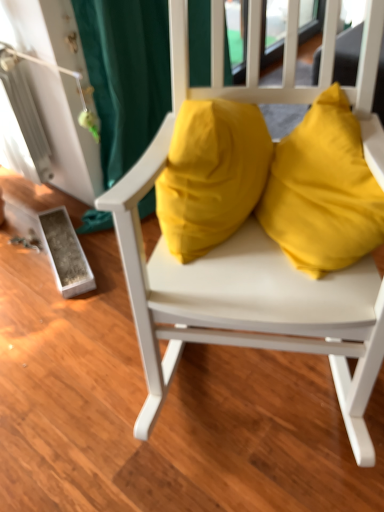
Question: Is yellow fabric pillow at center wider or thinner than matte yellow cushions at center?

Choices:
 (A) thin
 (B) wide

Answer: (A)

Question: Considering the relative positions of yellow fabric pillow at center and matte yellow cushions at center in the image provided, is yellow fabric pillow at center to the left or to the right of matte yellow cushions at center?

Choices:
 (A) left
 (B) right

Answer: (A)

Question: From a real-world perspective, is yellow fabric pillow at center above or below matte yellow cushions at center?

Choices:
 (A) below
 (B) above

Answer: (B)

Question: Looking at their shapes, would you say matte yellow cushions at center is wider or thinner than yellow fabric pillow at center?

Choices:
 (A) thin
 (B) wide

Answer: (B)

Question: Is matte yellow cushions at center in front of or behind yellow fabric pillow at center in the image?

Choices:
 (A) front
 (B) behind

Answer: (A)

Question: Considering the positions of matte yellow cushions at center and yellow fabric pillow at center in the image, is matte yellow cushions at center taller or shorter than yellow fabric pillow at center?

Choices:
 (A) tall
 (B) short

Answer: (A)

Question: From a real-world perspective, relative to yellow fabric pillow at center, is matte yellow cushions at center vertically above or below?

Choices:
 (A) above
 (B) below

Answer: (B)